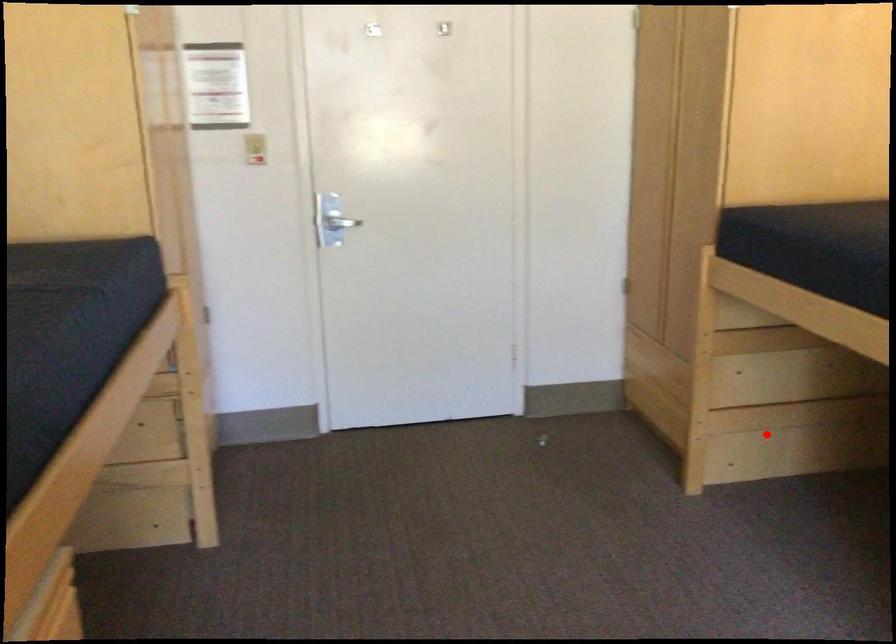
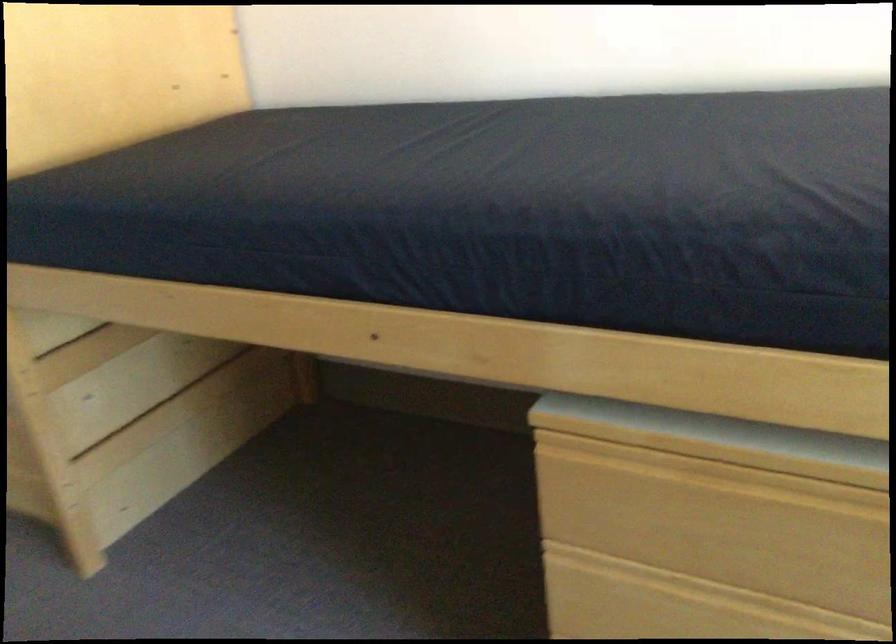
Where in the second image is the point corresponding to the highlighted location from the first image?

(152, 458)